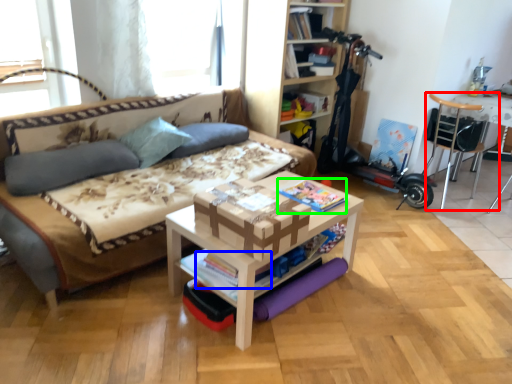
Question: Which is farther away from chair (highlighted by a red box)? magazine (highlighted by a blue box) or magazine (highlighted by a green box)?

Choices:
 (A) magazine
 (B) magazine

Answer: (A)